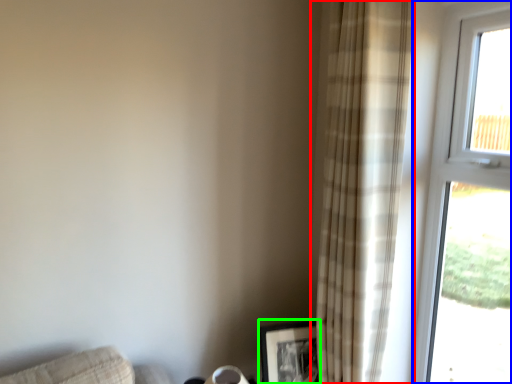
Question: Considering the real-world distances, which object is farthest from curtain (highlighted by a red box)? window (highlighted by a blue box) or picture frame (highlighted by a green box)?

Choices:
 (A) window
 (B) picture frame

Answer: (B)